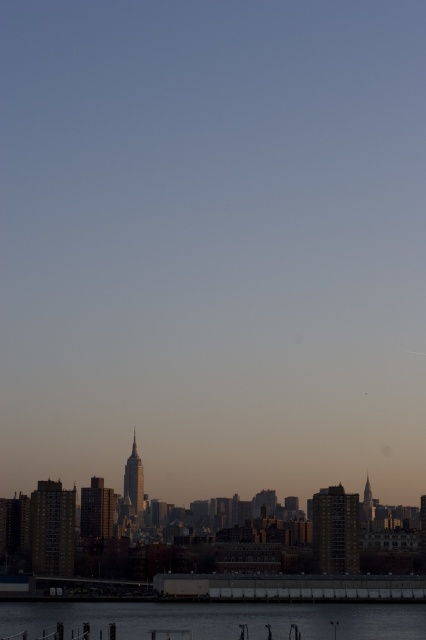
Question: Can you confirm if clear water at lower center is positioned below concrete dock at lower center?

Choices:
 (A) yes
 (B) no

Answer: (A)

Question: In this image, where is clear water at lower center located relative to concrete dock at lower center?

Choices:
 (A) right
 (B) left

Answer: (B)

Question: Can you confirm if clear water at lower center is wider than concrete dock at lower center?

Choices:
 (A) no
 (B) yes

Answer: (B)

Question: Which object is farther from the camera taking this photo?

Choices:
 (A) concrete dock at lower center
 (B) clear water at lower center

Answer: (B)

Question: Which object is closer to the camera taking this photo?

Choices:
 (A) concrete dock at lower center
 (B) clear water at lower center

Answer: (A)